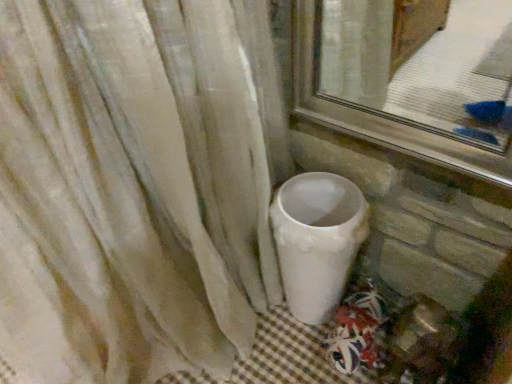
Describe the element at coordinates (317, 240) in the screenshot. This screenshot has height=384, width=512. I see `white glossy toilet at lower center` at that location.

I want to click on white glossy toilet at lower center, so click(x=317, y=240).

Where is `white glossy toilet at lower center`? The height and width of the screenshot is (384, 512). white glossy toilet at lower center is located at coordinates (317, 240).